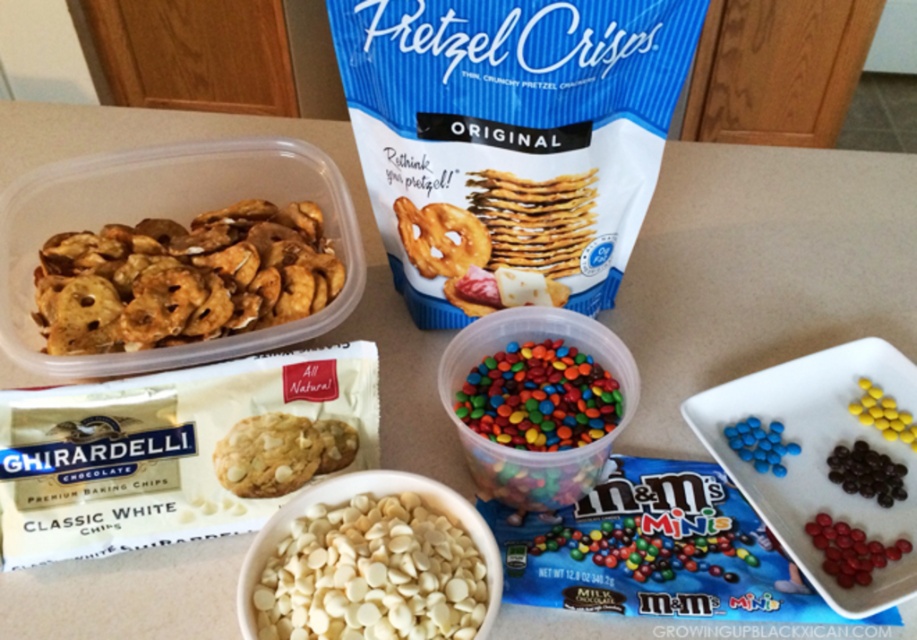
Is multicolored plastic container at center below white chocolate chip cookie at center?

No.

Who is higher up, multicolored plastic container at center or white chocolate chip cookie at center?

multicolored plastic container at center is higher up.

Is point (520, 413) less distant than point (249, 442)?

That is True.

Where is `multicolored plastic container at center`? multicolored plastic container at center is located at coordinates (540, 404).

Does point (451, 554) lie in front of point (882, 500)?

Yes, it is in front of point (882, 500).

Between white matte chips at center and dark chocolate coated m&m's at lower right, which one is positioned higher?

Positioned higher is dark chocolate coated m&m's at lower right.

Is point (323, 548) positioned in front of point (855, 477)?

Yes, point (323, 548) is in front of point (855, 477).

This screenshot has width=917, height=640. I want to click on white matte chips at center, so click(x=372, y=573).

From the picture: Does caramel-coated pretzels at upper left have a smaller size compared to salted pretzel at center?

No.

Who is more distant from viewer, (x=326, y=289) or (x=463, y=269)?

The point (x=463, y=269) is behind.

Is point (118, 333) in front of point (423, 234)?

Yes, point (118, 333) is in front of point (423, 234).

You are a GUI agent. You are given a task and a screenshot of the screen. Output one action in this format:
    pyautogui.click(x=<x>, y=<y>)
    Task: Click on the caramel-coated pretzels at upper left
    The height and width of the screenshot is (640, 917).
    Given the screenshot: What is the action you would take?
    pyautogui.click(x=183, y=278)